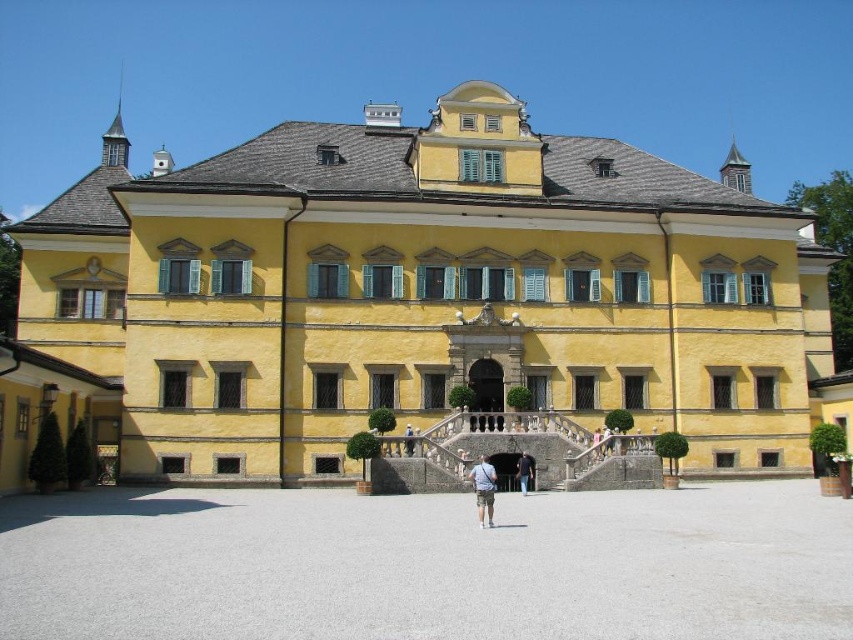
Question: Among these points, which one is nearest to the camera?

Choices:
 (A) (607, 438)
 (B) (732, 384)

Answer: (A)

Question: Does light blue denim shorts at center appear on the left side of brown leather bag at lower center?

Choices:
 (A) yes
 (B) no

Answer: (A)

Question: Is light blue denim shorts at center in front of brown leather bag at lower center?

Choices:
 (A) yes
 (B) no

Answer: (A)

Question: Which object is closer to the camera taking this photo?

Choices:
 (A) yellow matte building at center
 (B) light blue denim shorts at center

Answer: (B)

Question: Does brown leather bag at lower center lie in front of brown leather bag at center?

Choices:
 (A) yes
 (B) no

Answer: (A)

Question: Which point is farther to the camera?

Choices:
 (A) brown leather bag at lower center
 (B) light blue denim shorts at center

Answer: (A)